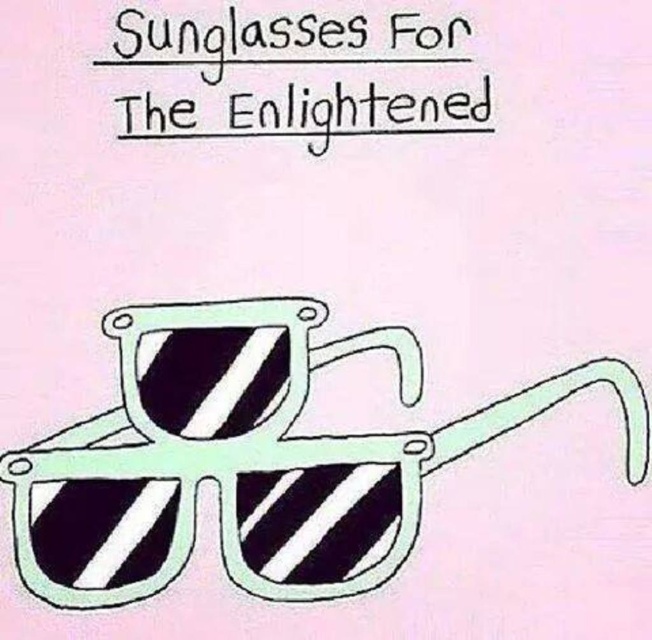
Question: Which of the following is the farthest from the observer?

Choices:
 (A) (198, 61)
 (B) (125, 476)

Answer: (B)

Question: Does white striped plastic sunglasses at center have a greater width compared to black paper at upper center?

Choices:
 (A) no
 (B) yes

Answer: (B)

Question: Does white striped plastic sunglasses at center have a greater width compared to black paper at upper center?

Choices:
 (A) yes
 (B) no

Answer: (A)

Question: Observing the image, what is the correct spatial positioning of white striped plastic sunglasses at center in reference to black paper at upper center?

Choices:
 (A) right
 (B) left

Answer: (A)

Question: Which of the following is the farthest from the observer?

Choices:
 (A) white striped plastic sunglasses at center
 (B) black paper at upper center

Answer: (B)

Question: Among these points, which one is farthest from the camera?

Choices:
 (A) (168, 483)
 (B) (394, 131)

Answer: (B)